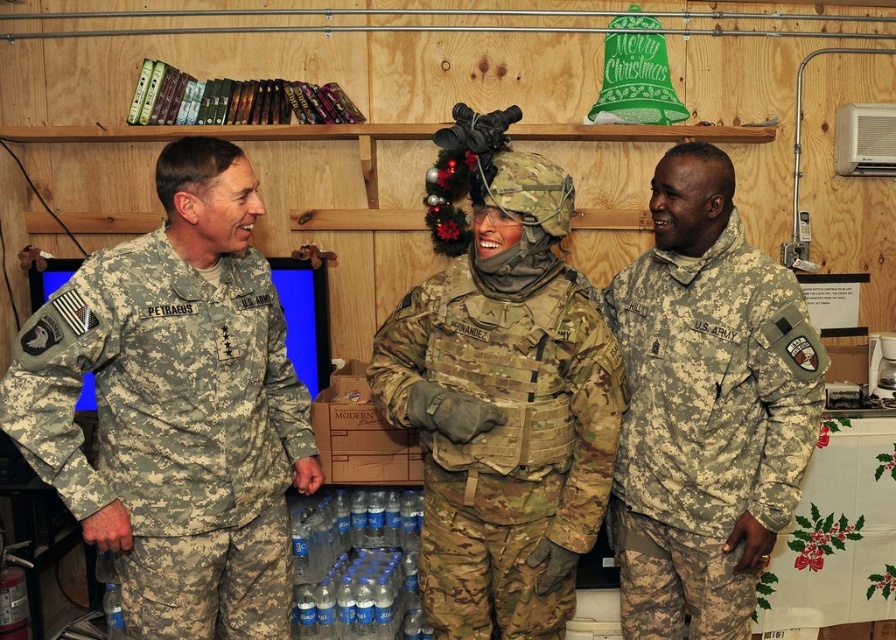
You are a photographer adjusting your camera settings to focus on two points in the image. The first point is labeled as point (x=790, y=272) and the second is point (x=625, y=406). Which point should you focus on first if you want to capture both points clearly in your photo?

You should focus on point (x=790, y=272) first because it is closer to the camera than point (x=625, y=406). This ensures that the closer point is in focus, and the farther point will also be sharp due to the depth of field.

You are a photographer trying to arrange three military personnel for a group photo. You notice the camouflage fabric uniform at left and the camouflage fabric uniform at center in the current setup. Which one should you ask to stand closer to the camera to make them appear the same height in the photo?

The camouflage fabric uniform at center should be asked to stand closer to the camera because the camouflage fabric uniform at left is much taller, so moving the shorter one forward can balance their apparent heights.

You are an observer in the room. You see the camouflage fabric uniform at left and the camouflage fabric uniform at right. Which one has a larger width?

The camouflage fabric uniform at left might be wider than camouflage fabric uniform at right according to the description.